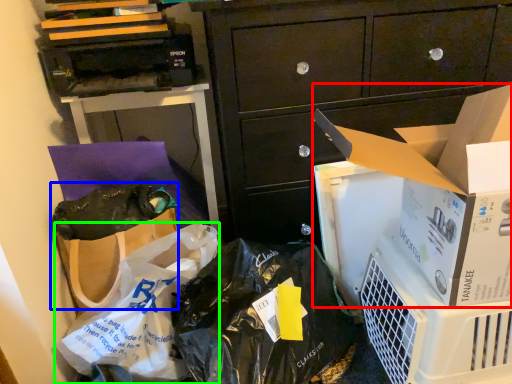
Question: Which object is positioned closest to cardboard box (highlighted by a red box)? Select from handbag (highlighted by a blue box) and plastic bag (highlighted by a green box).

Choices:
 (A) handbag
 (B) plastic bag

Answer: (B)